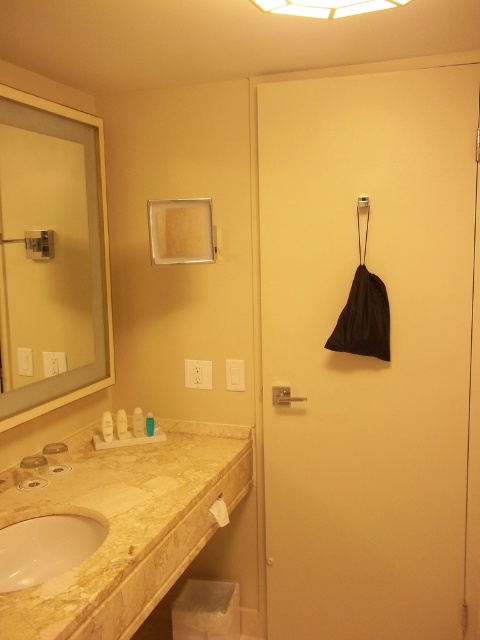
You are a bathroom designer planning to place a new decorative item on the surface between the white marble sink at lower left and the white plastic bottles at lower left. Based on their positions, where should you place the item to ensure it is between them?

The white marble sink at lower left is below the white plastic bottles at lower left, so placing the decorative item between them would require positioning it above the sink but below the bottles.

You are organizing the bathroom and need to access the translucent plastic bottle at lower left. Is the black fabric bag at right blocking your access to it?

The black fabric bag at right is positioned over the translucent plastic bottle at lower left, so it is blocking access to the bottle. You would need to move the bag to reach the bottle.